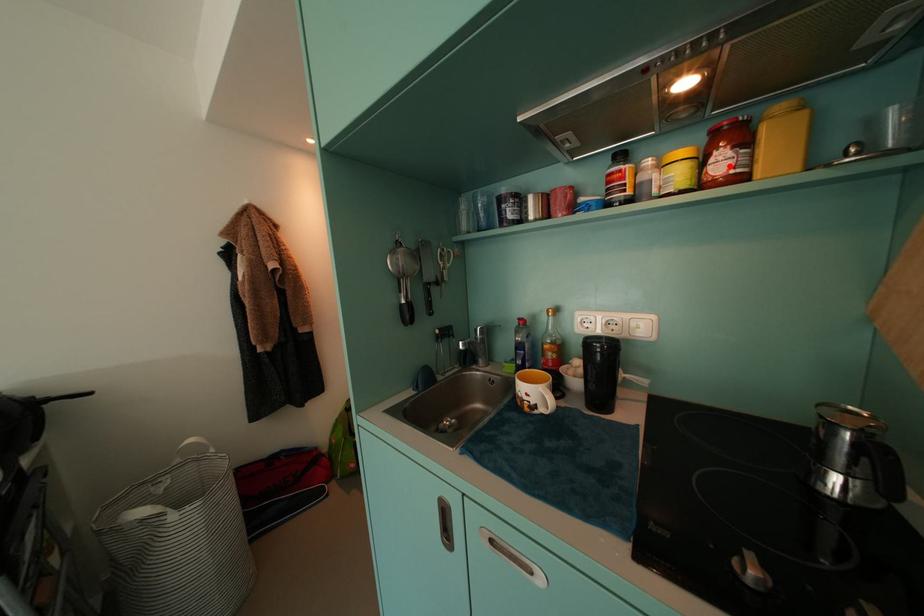
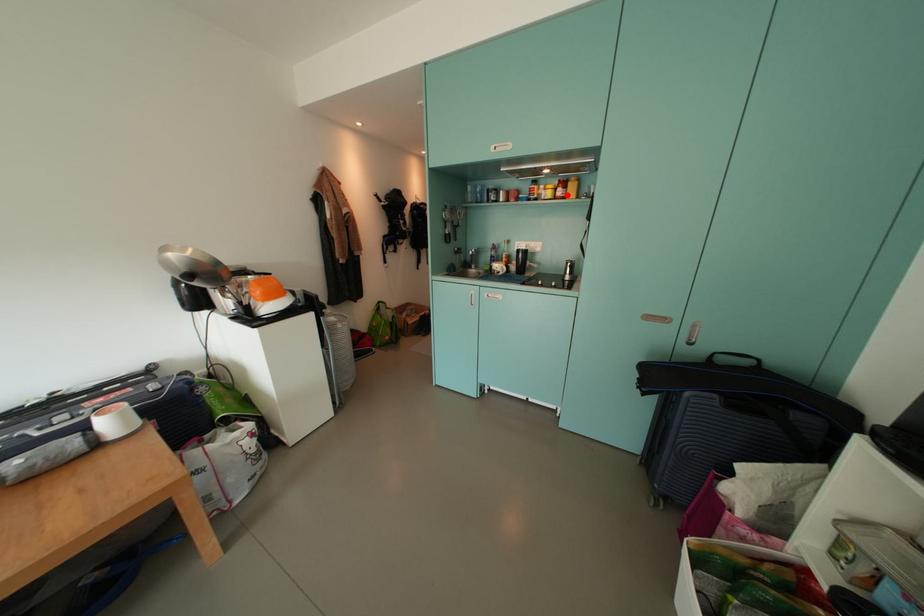
Consider the image. I am providing you with two images of the same scene from different viewpoints. A red point is marked on the first image and another point is marked on the second image. Are the points marked in image1 and image2 representing the same 3D position?

Yes